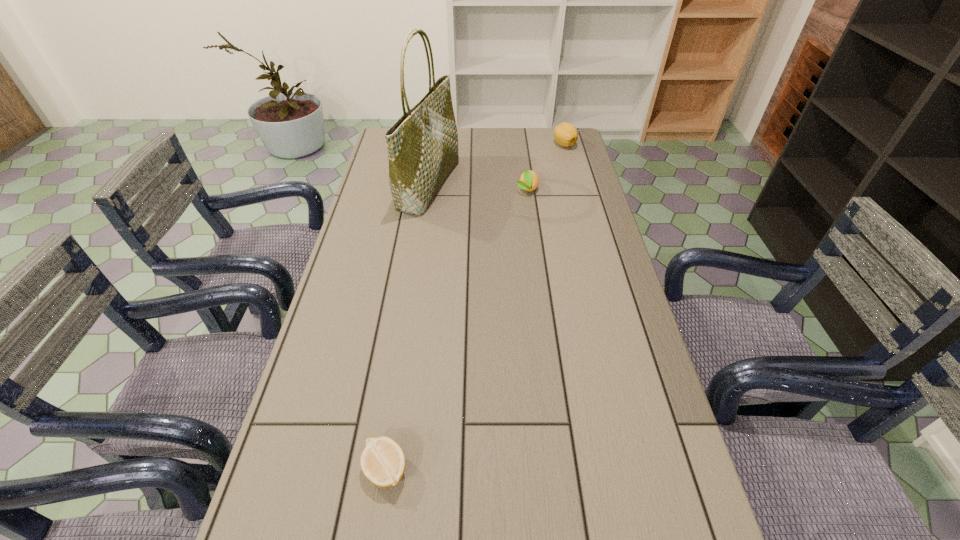
Where is `free space located 0.170m on the left of the leftmost lemon`? Image resolution: width=960 pixels, height=540 pixels. free space located 0.170m on the left of the leftmost lemon is located at coordinates (276, 470).

Find the location of `shopping bag that is positioned at the far edge`. shopping bag that is positioned at the far edge is located at coordinates (422, 145).

Where is `lemon situated at the far edge`? The image size is (960, 540). lemon situated at the far edge is located at coordinates (565, 134).

Where is `object that is at the left edge`? The image size is (960, 540). object that is at the left edge is located at coordinates (422, 145).

Identify the location of object at the right edge. This screenshot has width=960, height=540. (565, 134).

Locate an element on the screen. This screenshot has height=540, width=960. object located at the far left corner is located at coordinates (422, 145).

Image resolution: width=960 pixels, height=540 pixels. In order to click on object at the far right corner in this screenshot , I will do `click(565, 134)`.

Where is `vacant position at the far edge of the desktop`? This screenshot has width=960, height=540. vacant position at the far edge of the desktop is located at coordinates (469, 146).

The width and height of the screenshot is (960, 540). I want to click on free space at the left edge of the desktop, so click(384, 185).

I want to click on blank space at the right edge of the desktop, so click(x=552, y=172).